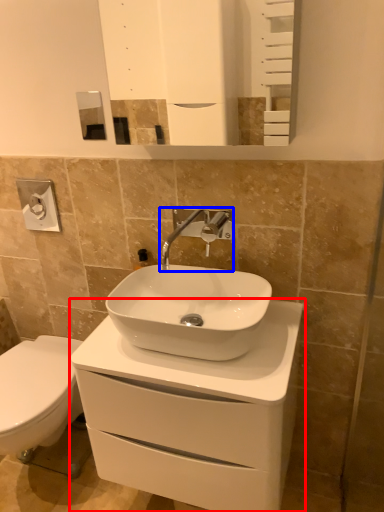
Question: Which object appears farthest to the camera in this image, bathroom cabinet (highlighted by a red box) or tap (highlighted by a blue box)?

Choices:
 (A) bathroom cabinet
 (B) tap

Answer: (B)